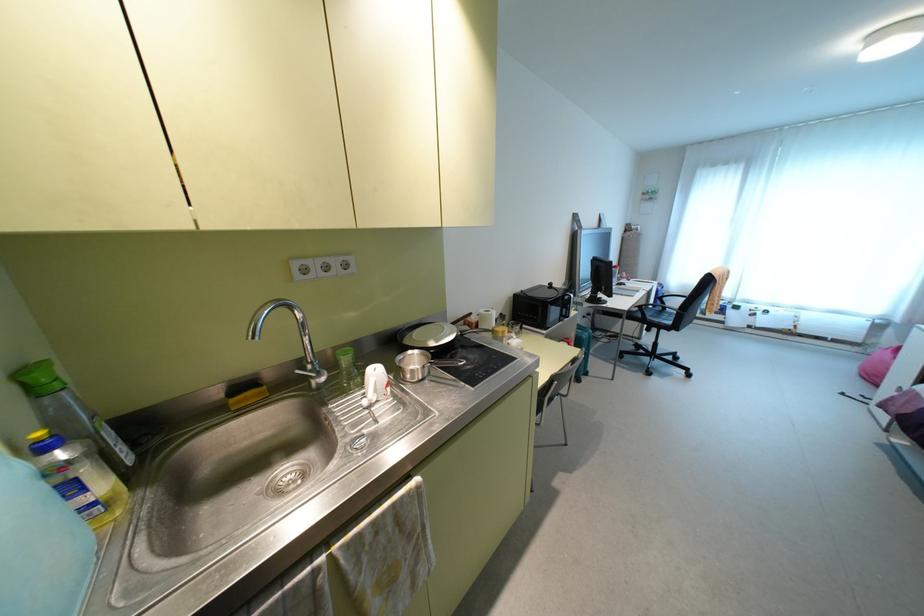
Where would you lift the white pitcher handle? Please return your answer as a coordinate pair (x, y).

(370, 392)